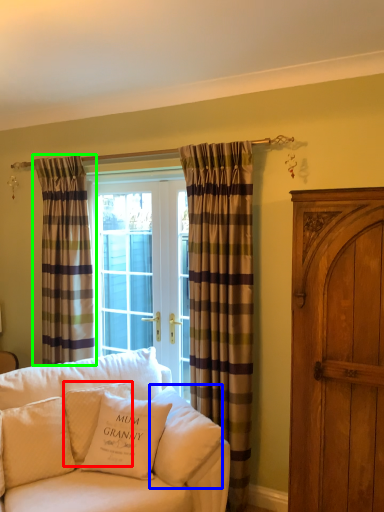
Question: Which object is positioned closest to pillow (highlighted by a red box)? Select from pillow (highlighted by a blue box) and curtain (highlighted by a green box).

Choices:
 (A) pillow
 (B) curtain

Answer: (A)